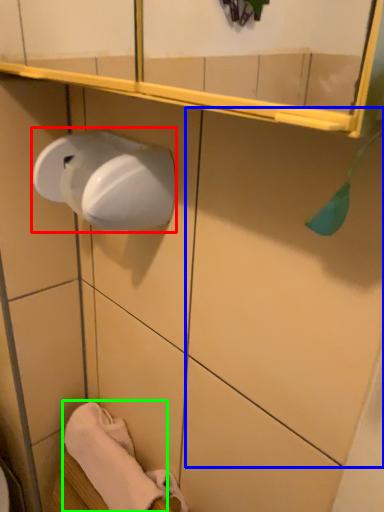
Question: Considering the real-world distances, which object is farthest from paper towel (highlighted by a red box)? tile (highlighted by a blue box) or bath towel (highlighted by a green box)?

Choices:
 (A) tile
 (B) bath towel

Answer: (B)